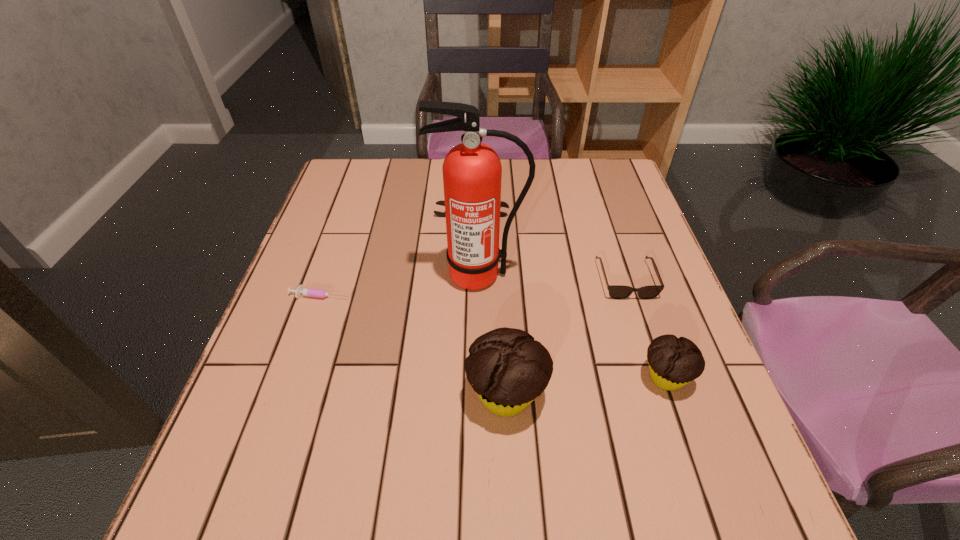
Please point a free position for a muffin on the left. Please provide its 2D coordinates. Your answer should be formatted as a tuple, i.e. [(x, y)], where the tuple contains the x and y coordinates of a point satisfying the conditions above.

[(337, 413)]